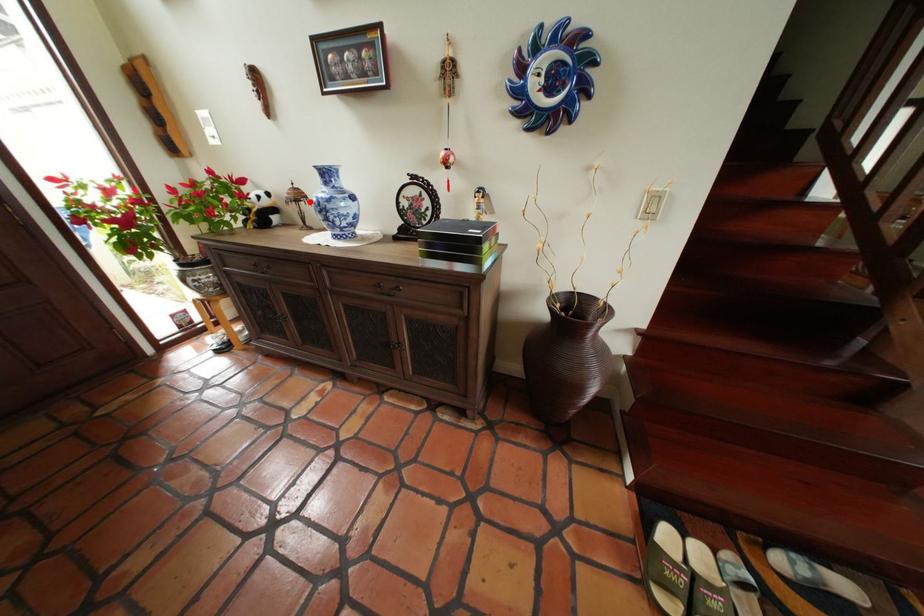
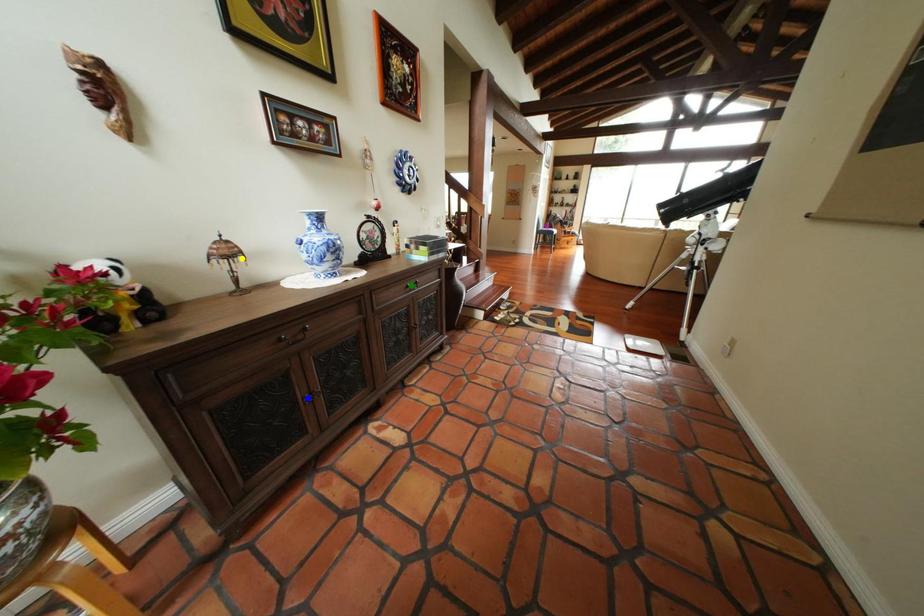
Question: I am providing you with two images of the same scene from different viewpoints. A red point is marked on the first image. You are given multiple points on the second image. Can you choose the point in image 2 that corresponds to the point in image 1?

Choices:
 (A) green point
 (B) yellow point
 (C) blue point

Answer: (B)